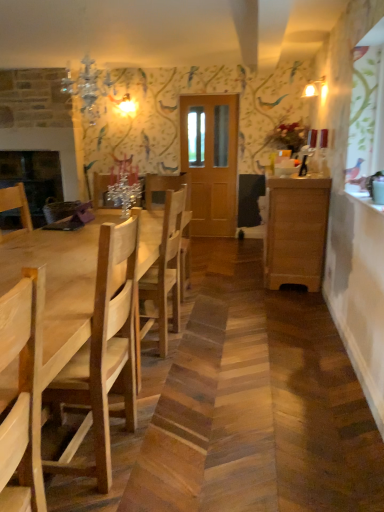
Question: Is wooden cabinet at right wider or thinner than wooden chair at left, which appears as the 2th chair when viewed from the back?

Choices:
 (A) thin
 (B) wide

Answer: (B)

Question: Is wooden cabinet at right situated inside wooden chair at left, placed as the 1th chair when sorted from front to back, or outside?

Choices:
 (A) inside
 (B) outside

Answer: (B)

Question: Which is nearer to the natural wood chair at center, which is the second chair in front-to-back order?

Choices:
 (A) light brown wooden table at left
 (B) wooden cabinet at right
 (C) wooden chair at left, placed as the 1th chair when sorted from front to back

Answer: (A)

Question: Which object is the farthest from the wooden cabinet at right?

Choices:
 (A) natural wood chair at center, the first chair positioned from the back
 (B) light brown wooden table at left
 (C) wooden chair at left, placed as the 1th chair when sorted from front to back

Answer: (C)